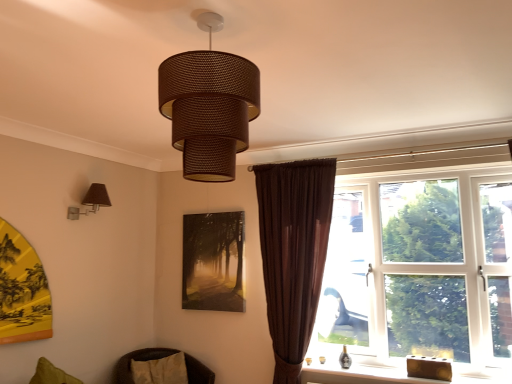
Question: From a real-world perspective, is brown woven cushion at lower left on matte brown lampshade at left, the second lamp in the front-to-back sequence?

Choices:
 (A) no
 (B) yes

Answer: (A)

Question: Does brown woven cushion at lower left have a smaller size compared to matte brown lampshade at left, placed as the 1th lamp when sorted from bottom to top?

Choices:
 (A) yes
 (B) no

Answer: (B)

Question: From the image's perspective, is brown woven cushion at lower left located beneath matte brown lampshade at left, the second lamp in the front-to-back sequence?

Choices:
 (A) no
 (B) yes

Answer: (B)

Question: Is brown woven cushion at lower left oriented towards matte brown lampshade at left, marked as the 2th lamp in a top-to-bottom arrangement?

Choices:
 (A) no
 (B) yes

Answer: (A)

Question: Considering the relative sizes of brown woven cushion at lower left and matte brown lampshade at left, which is the first lamp in left-to-right order, in the image provided, is brown woven cushion at lower left taller than matte brown lampshade at left, which is the first lamp in left-to-right order,?

Choices:
 (A) yes
 (B) no

Answer: (A)

Question: From a real-world perspective, is brown woven lampshade at center, which ranks as the second lamp in back-to-front order, above or below wooden block at lower right?

Choices:
 (A) below
 (B) above

Answer: (B)

Question: Is brown woven lampshade at center, the second lamp from the bottom, to the left or to the right of wooden block at lower right in the image?

Choices:
 (A) left
 (B) right

Answer: (A)

Question: Looking at the image, does brown woven lampshade at center, which ranks as the second lamp in back-to-front order, seem bigger or smaller compared to wooden block at lower right?

Choices:
 (A) small
 (B) big

Answer: (B)

Question: Is brown woven lampshade at center, which is the first lamp in front-to-back order, taller or shorter than wooden block at lower right?

Choices:
 (A) tall
 (B) short

Answer: (A)

Question: In the image, is brown woven cushion at lower left on the left side or the right side of matte brown lampshade at left, which is the first lamp in left-to-right order?

Choices:
 (A) right
 (B) left

Answer: (A)

Question: From a real-world perspective, is brown woven cushion at lower left above or below matte brown lampshade at left, marked as the 2th lamp in a top-to-bottom arrangement?

Choices:
 (A) above
 (B) below

Answer: (B)

Question: Do you think brown woven cushion at lower left is within matte brown lampshade at left, the second lamp in the front-to-back sequence, or outside of it?

Choices:
 (A) inside
 (B) outside

Answer: (B)

Question: Is brown woven cushion at lower left wider or thinner than matte brown lampshade at left, the second lamp in the front-to-back sequence?

Choices:
 (A) thin
 (B) wide

Answer: (B)

Question: Is brown velvet curtain at right wider or thinner than brown woven lampshade at center, which is the first lamp in front-to-back order?

Choices:
 (A) wide
 (B) thin

Answer: (B)

Question: Considering their positions, is brown velvet curtain at right located in front of or behind brown woven lampshade at center, which is the first lamp in front-to-back order?

Choices:
 (A) behind
 (B) front

Answer: (A)